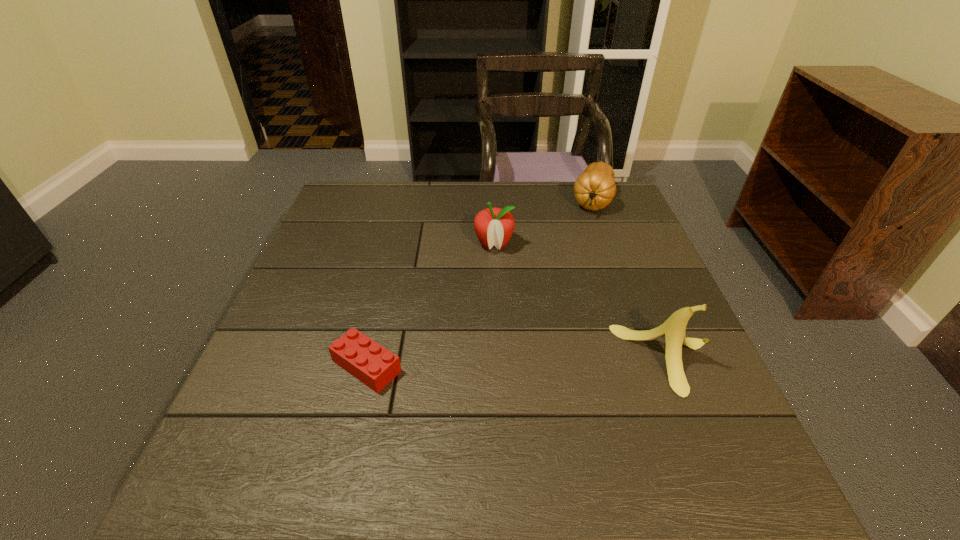
Locate an element on the screen. Image resolution: width=960 pixels, height=540 pixels. vacant space on the desktop that is between the shortest object and the banana and is positioned on the side where a bite is taken out of the third object from right to left is located at coordinates (480, 363).

The image size is (960, 540). In order to click on free space on the desktop that is between the shortest object and the banana and is positioned on the stem side of the farthest object in this screenshot , I will do `click(546, 362)`.